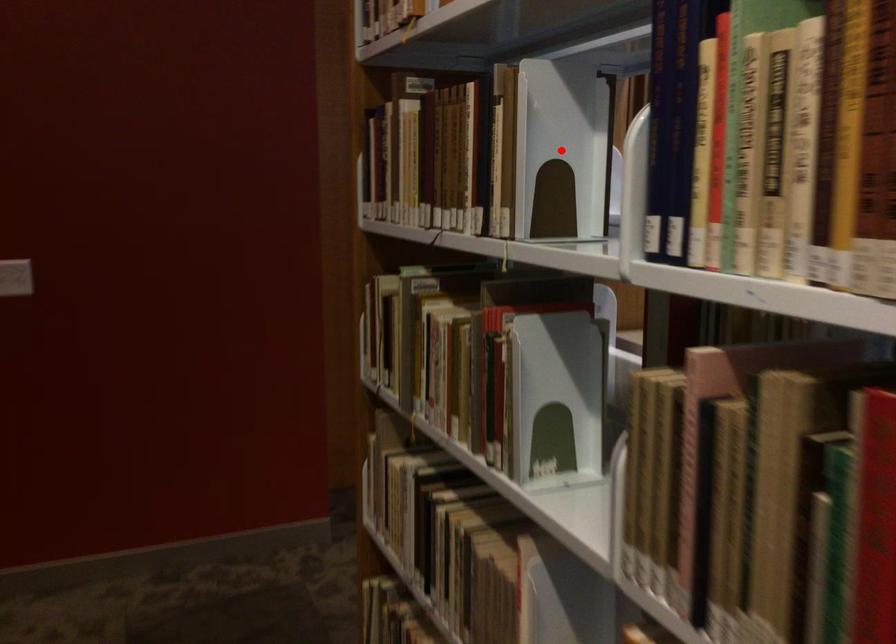
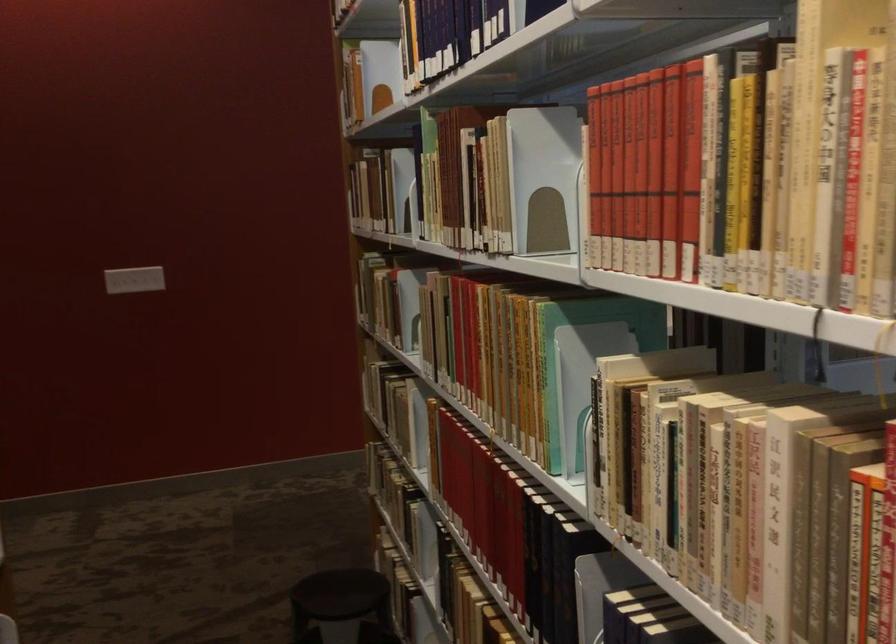
Question: I am providing you with two images of the same scene from different viewpoints. A red point is marked on the first image. Can you still see the location of the red point in image 2?

Choices:
 (A) Yes
 (B) No

Answer: (B)